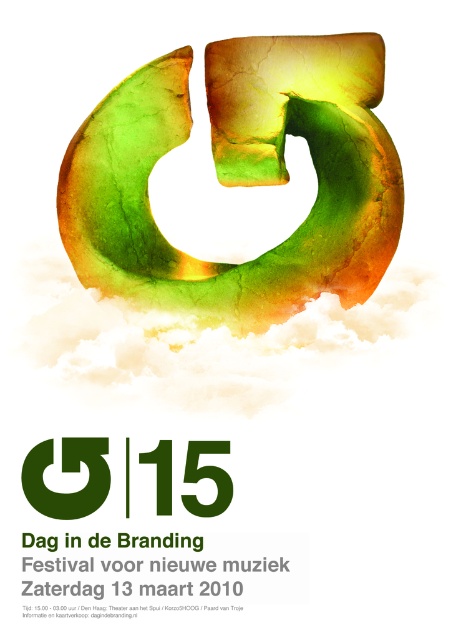
Does green matte circle at center appear on the left side of green matte number at center?

Indeed, green matte circle at center is positioned on the left side of green matte number at center.

Does green matte circle at center have a larger size compared to green matte number at center?

Yes.

The height and width of the screenshot is (640, 471). What do you see at coordinates (67, 470) in the screenshot?
I see `green matte circle at center` at bounding box center [67, 470].

Where is `green matte circle at center`? The height and width of the screenshot is (640, 471). green matte circle at center is located at coordinates (67, 470).

Does green cracked stone at center have a lesser width compared to green matte number at center?

No.

Locate an element on the screen. green cracked stone at center is located at coordinates (240, 177).

Can you confirm if green cracked stone at center is positioned to the right of green matte circle at center?

Yes, green cracked stone at center is to the right of green matte circle at center.

Between point (307, 132) and point (27, 467), which one is positioned behind?

The point (307, 132) is behind.

I want to click on green cracked stone at center, so click(x=240, y=177).